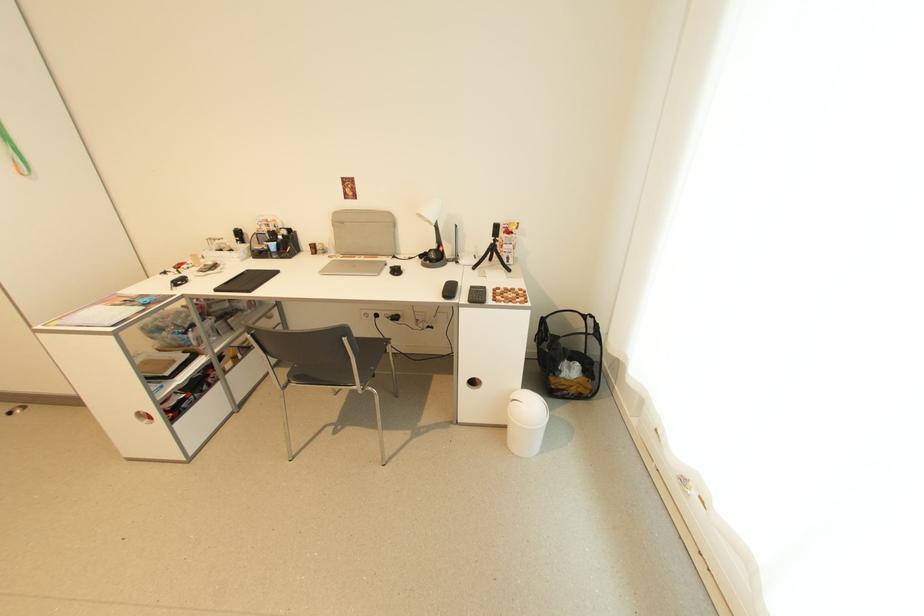
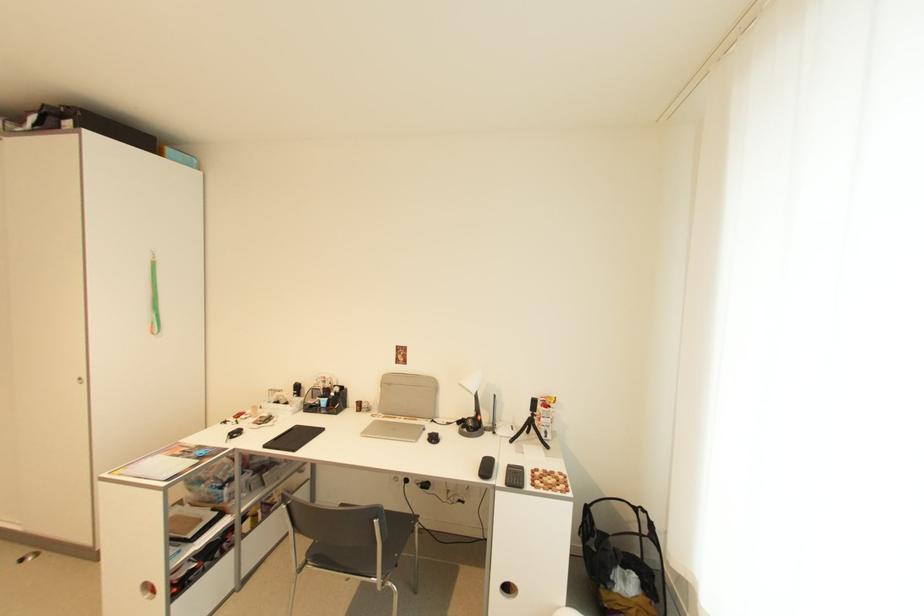
Question: Which direction would the cameraman need to move to produce the second image? Reply with the corresponding letter.

Choices:
 (A) Left
 (B) Right
 (C) Forward
 (D) Backward

Answer: (D)